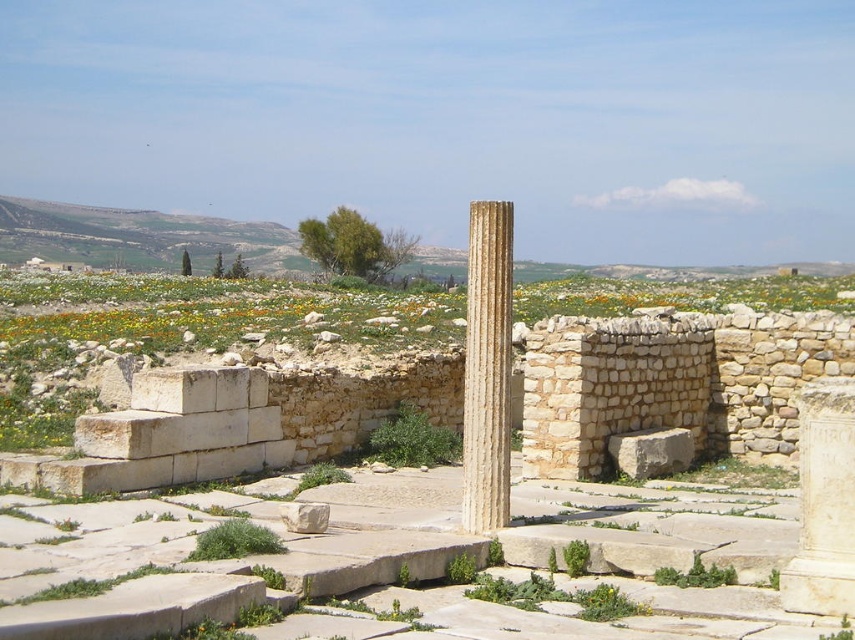
Question: Among these objects, which one is nearest to the camera?

Choices:
 (A) beige stone column at center
 (B) white marble column at right

Answer: (B)

Question: Is beige stone column at center smaller than white marble column at right?

Choices:
 (A) no
 (B) yes

Answer: (B)

Question: Can you confirm if beige stone column at center is positioned to the right of white marble column at right?

Choices:
 (A) yes
 (B) no

Answer: (B)

Question: Among these objects, which one is nearest to the camera?

Choices:
 (A) beige stone column at center
 (B) white marble column at right

Answer: (B)

Question: Does beige stone column at center appear over white marble column at right?

Choices:
 (A) no
 (B) yes

Answer: (B)